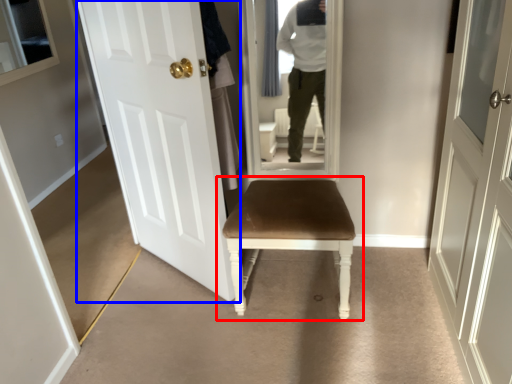
Question: Which object is further to the camera taking this photo, chair (highlighted by a red box) or door (highlighted by a blue box)?

Choices:
 (A) chair
 (B) door

Answer: (A)